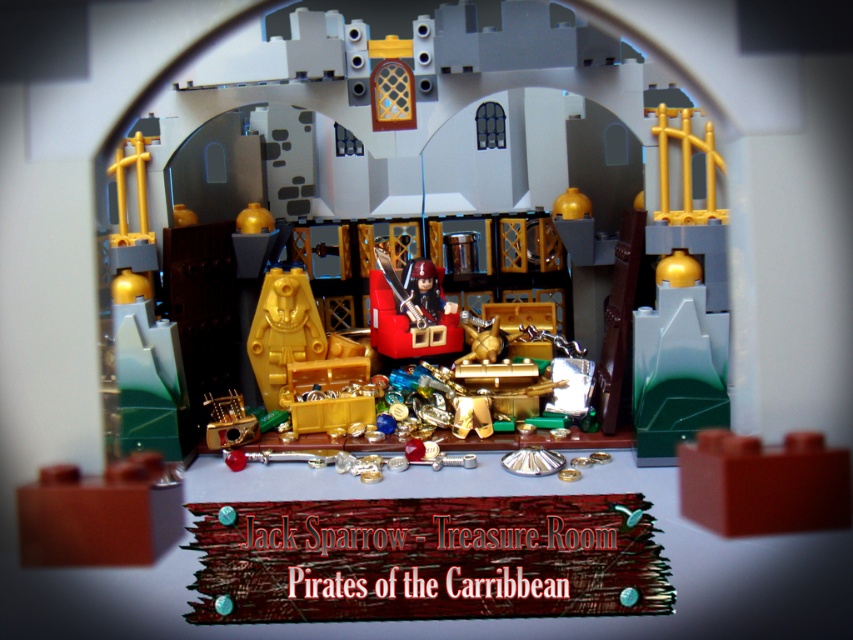
Who is shorter, matte black pirate ship at center or matte gold treasure chest at center?

matte black pirate ship at center

Is matte black pirate ship at center above matte gold treasure chest at center?

Yes, matte black pirate ship at center is above matte gold treasure chest at center.

Looking at this image, who is more forward, (447,308) or (274,400)?

Positioned in front is point (274,400).

Where is `matte black pirate ship at center`? The height and width of the screenshot is (640, 853). matte black pirate ship at center is located at coordinates (413, 312).